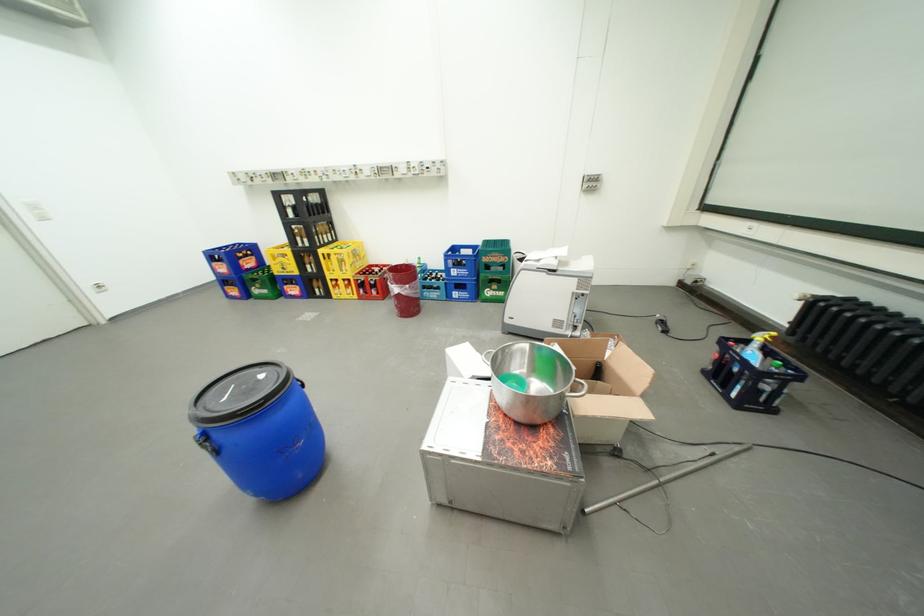
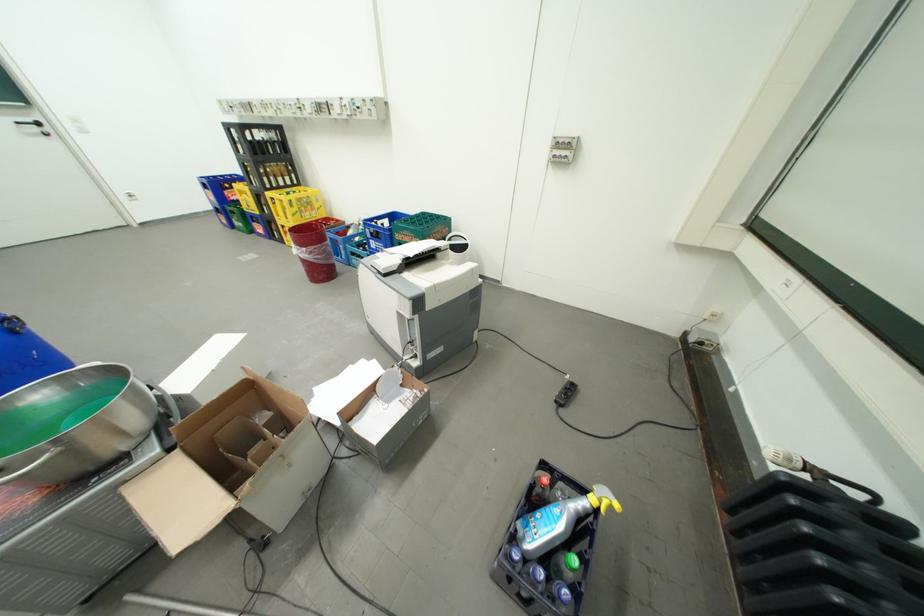
In a continuous first-person perspective shot, in which direction is the camera moving?

The cameraman moved toward right, forward.